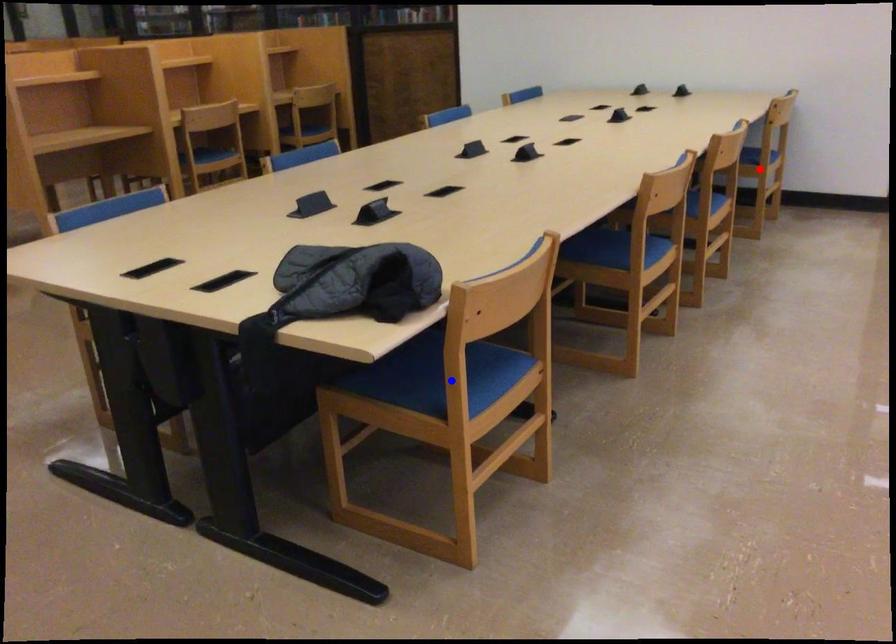
Question: Two points are marked on the image. Which point is closer to the camera?

Choices:
 (A) Blue point is closer.
 (B) Red point is closer.

Answer: (A)